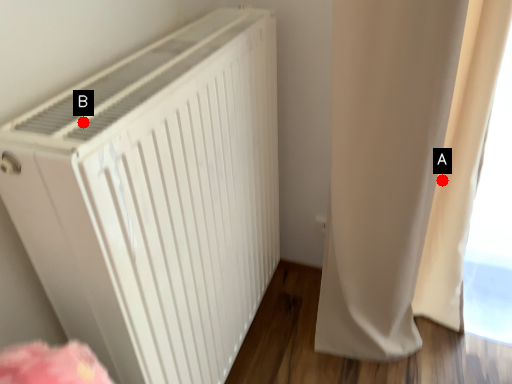
Question: Two points are circled on the image, labeled by A and B beside each circle. Among these points, which one is nearest to the camera?

Choices:
 (A) A is closer
 (B) B is closer

Answer: (B)